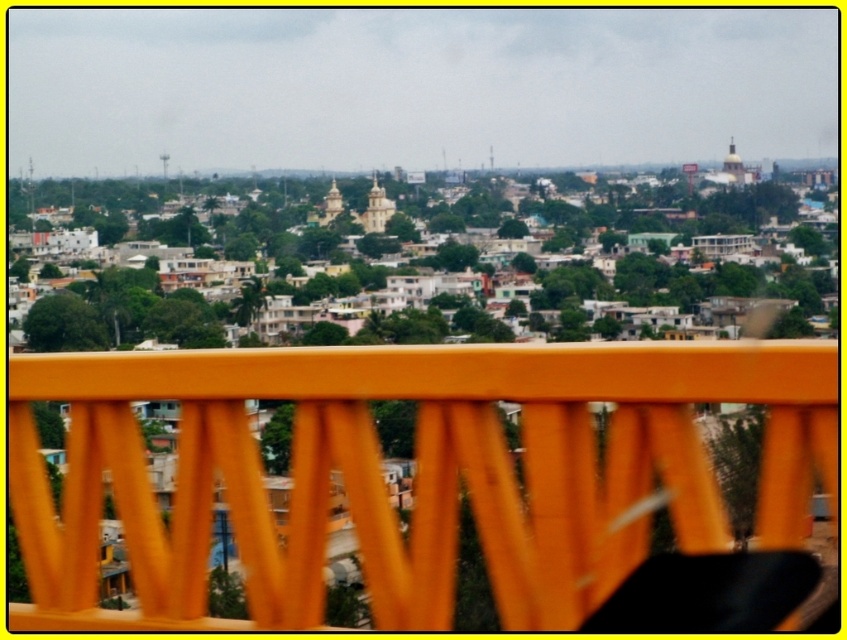
You are standing at the edge of a balcony overlooking the city. You notice an orange matte rail at center. Can you determine its exact location in terms of coordinates?

The orange matte rail at center is located at coordinates point (414, 472).

You are standing on a balcony overlooking the city and see the orange matte rail at center and the matte gold dome at upper center. Which object is closer to you?

The orange matte rail at center is closer to you because it is located below the matte gold dome at upper center, which is further away.